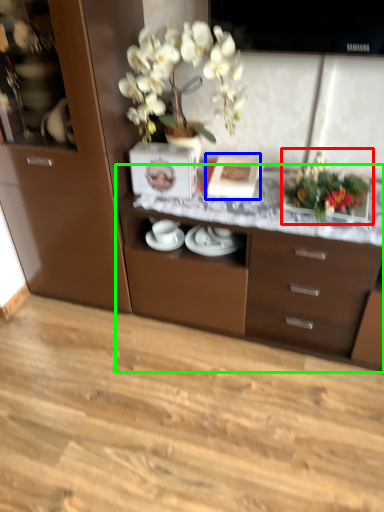
Question: Which object is positioned closest to floral arrangement (highlighted by a red box)? Select from picture frame (highlighted by a blue box) and desk (highlighted by a green box).

Choices:
 (A) picture frame
 (B) desk

Answer: (A)